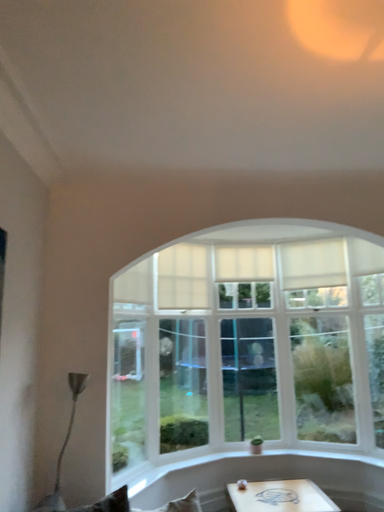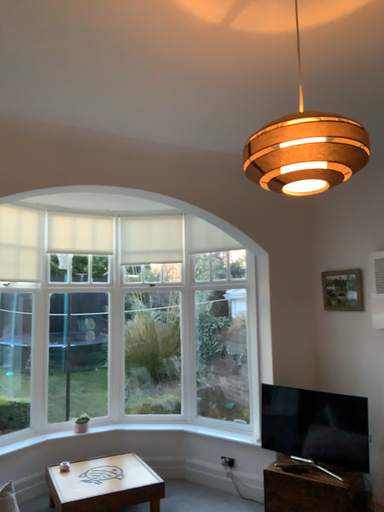
Question: How did the camera likely rotate when shooting the video?

Choices:
 (A) rotated left
 (B) rotated right

Answer: (B)